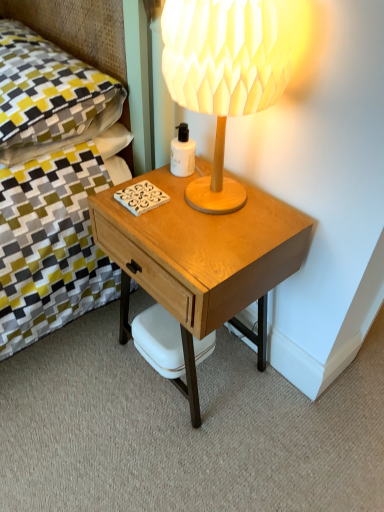
Locate an element on the screen. Image resolution: width=384 pixels, height=512 pixels. vacant space in front of white matte bottle at center is located at coordinates (190, 203).